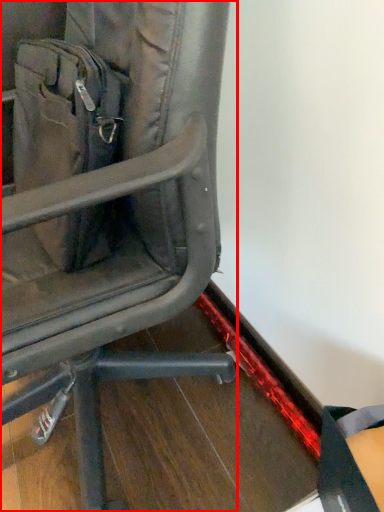
Question: From the image, what is the correct spatial relationship of chair (annotated by the red box) in relation to messenger bag?

Choices:
 (A) right
 (B) left

Answer: (A)